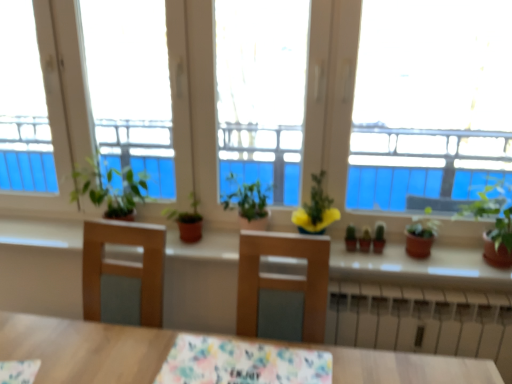
Locate an element on the screen. This screenshot has width=512, height=384. free space above white metallic radiator at lower center (from a real-world perspective) is located at coordinates (433, 290).